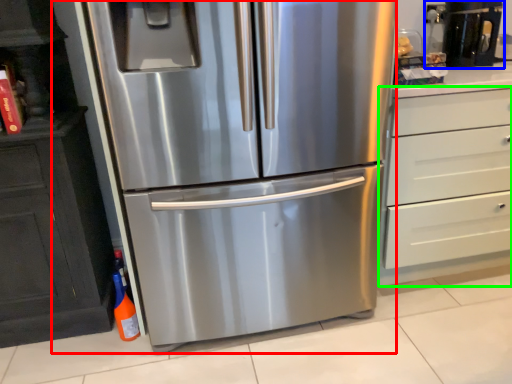
Question: Considering the real-world distances, which object is farthest from refrigerator (highlighted by a red box)? coffee machine (highlighted by a blue box) or chest of drawers (highlighted by a green box)?

Choices:
 (A) coffee machine
 (B) chest of drawers

Answer: (A)